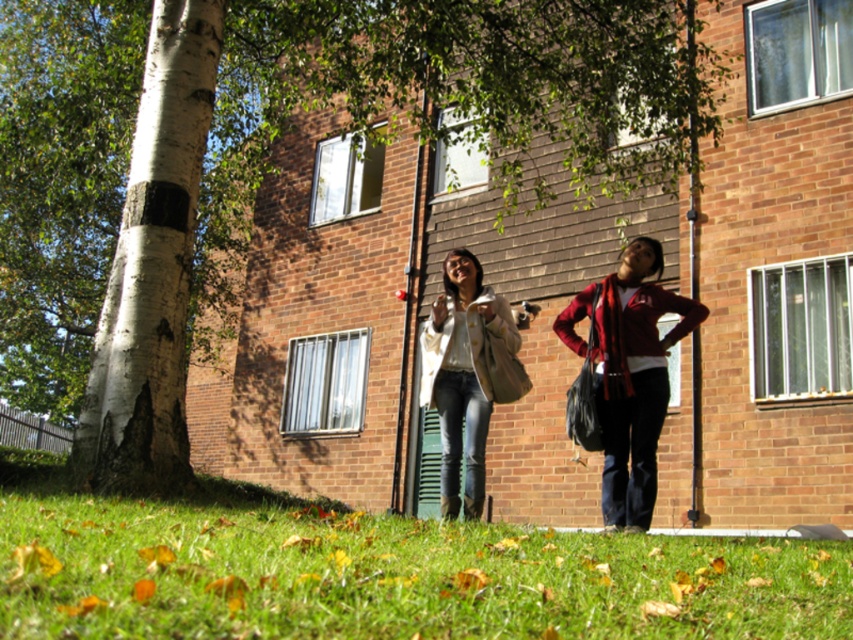
Question: Does white bark tree at left have a smaller size compared to red plaid scarf at lower right?

Choices:
 (A) no
 (B) yes

Answer: (A)

Question: Which point appears closest to the camera in this image?

Choices:
 (A) (645, 516)
 (B) (94, 525)
 (C) (695, 77)
 (D) (474, 372)

Answer: (B)

Question: Does green grass at lower center appear under red plaid scarf at lower right?

Choices:
 (A) no
 (B) yes

Answer: (B)

Question: Does red plaid scarf at lower right have a larger size compared to white matte jacket at center?

Choices:
 (A) no
 (B) yes

Answer: (B)

Question: Which of these objects is positioned closest to the red plaid scarf at lower right?

Choices:
 (A) white matte jacket at center
 (B) green grass at lower center
 (C) white bark tree at left

Answer: (A)

Question: Which point appears farthest from the camera in this image?

Choices:
 (A) [x=647, y=388]
 (B) [x=93, y=508]
 (C) [x=425, y=380]
 (D) [x=281, y=70]

Answer: (D)